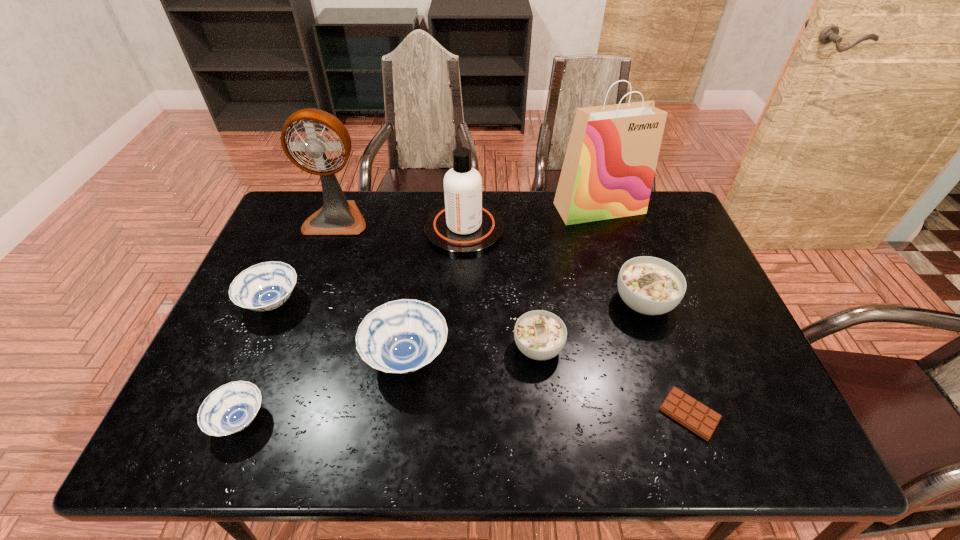
Identify the location of the nearer white soup bowl. This screenshot has width=960, height=540. (540, 335).

The width and height of the screenshot is (960, 540). In order to click on the eighth tallest object in this screenshot , I will do `click(229, 409)`.

I want to click on the smallest blue soup bowl, so click(229, 409).

Image resolution: width=960 pixels, height=540 pixels. What are the coordinates of `the shortest object` in the screenshot? It's located at (700, 419).

Find the location of a particular element. The image size is (960, 540). vacant area located 0.390m on the left of the shopping bag is located at coordinates (439, 208).

Where is `free space located 0.290m on the front-facing side of the brown fan`? free space located 0.290m on the front-facing side of the brown fan is located at coordinates (305, 306).

The width and height of the screenshot is (960, 540). Identify the location of free space located 0.350m on the left of the cleansing agent. click(x=316, y=229).

Locate an element on the screen. This screenshot has height=540, width=960. free space located 0.300m on the front of the rightmost soup bowl is located at coordinates (690, 440).

At what (x,y) coordinates should I click in order to perform the action: click on vacant space situated on the right of the biggest blue soup bowl. Please return your answer as a coordinate pair (x, y). The width and height of the screenshot is (960, 540). Looking at the image, I should click on (x=613, y=357).

At what (x,y) coordinates should I click in order to perform the action: click on vacant space located on the front of the second smallest blue soup bowl. Please return your answer as a coordinate pair (x, y). This screenshot has height=540, width=960. Looking at the image, I should click on (252, 350).